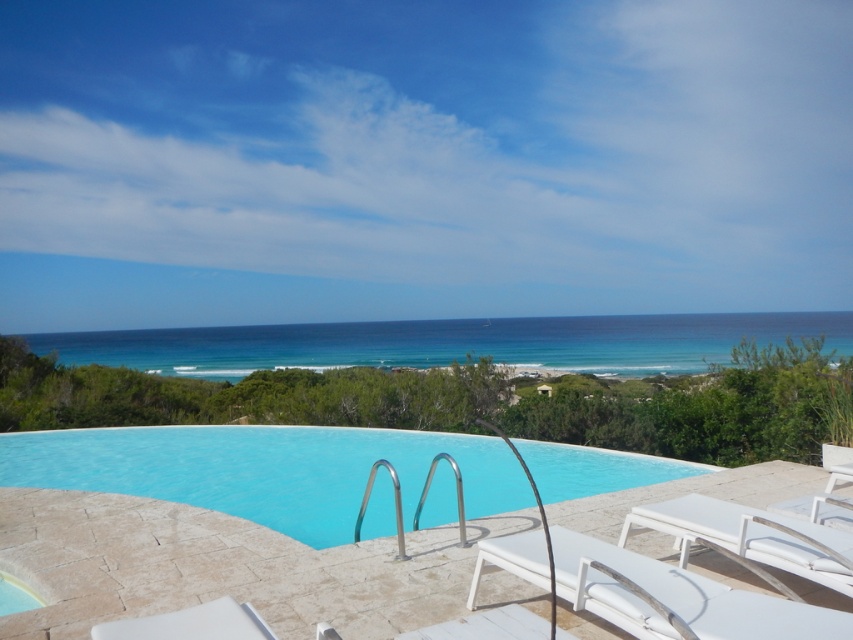
You are planning to place a large rectangular table that is 2 meters wide between the smooth glass pool at center and the white matte beach chair at lower right. Based on the scene description, will the space between them be wide enough to accommodate the table?

The smooth glass pool at center has a lesser width compared to white matte beach chair at lower right. However, the description does not provide specific measurements of the distance between them, so it is unclear if the space is wide enough for a 2 meter table.

You are standing at the edge of the pool and want to reach the white fabric beach chair at lower right. According to the scene, is the chair located in front of or behind the smooth glass pool at center?

The white fabric beach chair at lower right is behind the smooth glass pool at center, so it is located behind the pool.

You are a guest at this poolside area and want to sit on one of the chairs. If you first approach the white fabric beach chair at lower right and then move to the white matte beach chair at lower right, in which direction should you walk from the first chair to reach the second?

You should walk to the right from the white fabric beach chair at lower right to reach the white matte beach chair at lower right because the white fabric beach chair at lower right is positioned to the left of the white matte beach chair at lower right.